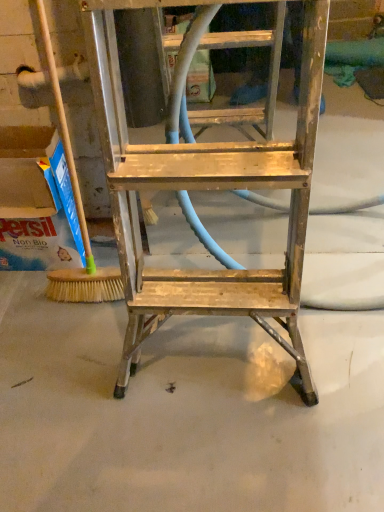
Describe the element at coordinates (204, 189) in the screenshot. The width and height of the screenshot is (384, 512). I see `rusty metal ladder at center` at that location.

The image size is (384, 512). What are the coordinates of `rusty metal ladder at center` in the screenshot? It's located at (204, 189).

Measure the distance between rusty metal ladder at center and camera.

rusty metal ladder at center and camera are 24.13 inches apart.

This screenshot has width=384, height=512. In order to click on rusty metal ladder at center in this screenshot , I will do `click(204, 189)`.